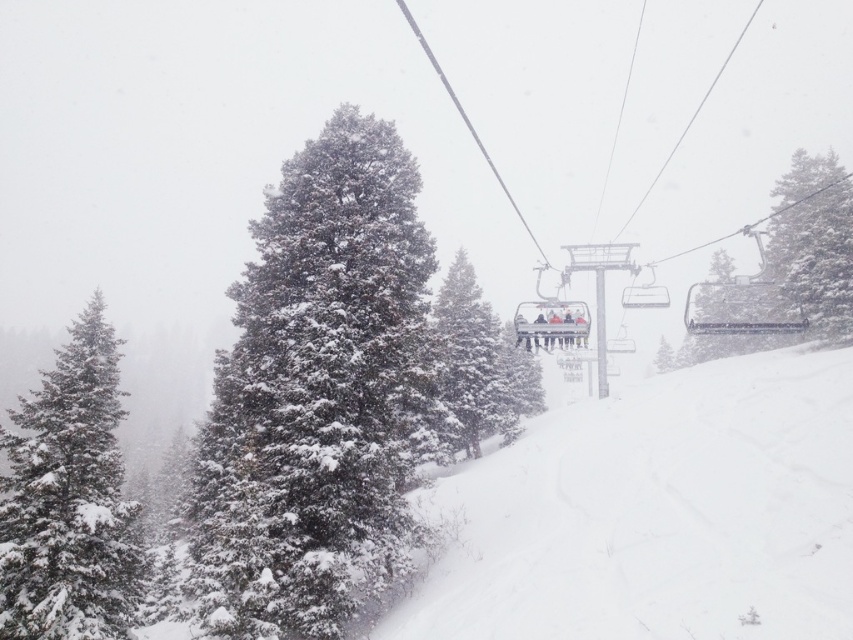
You are a photographer trying to capture the green textured pine tree at upper right and the white snow at center in your shot. Based on their sizes in the image, which one would appear closer to the camera?

The white snow at center appears closer to the camera because it has a smaller size compared to the green textured pine tree at upper right, indicating it is nearer due to perspective.